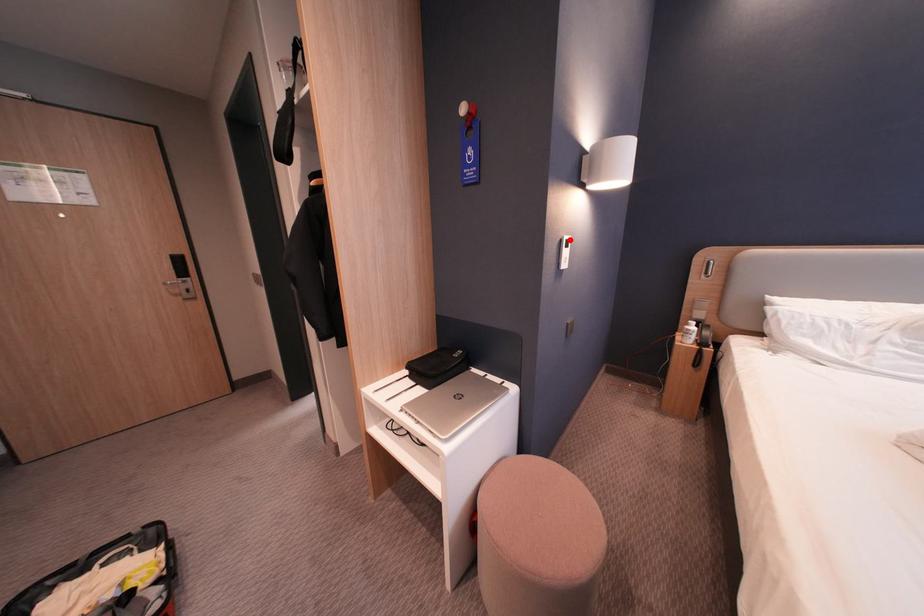
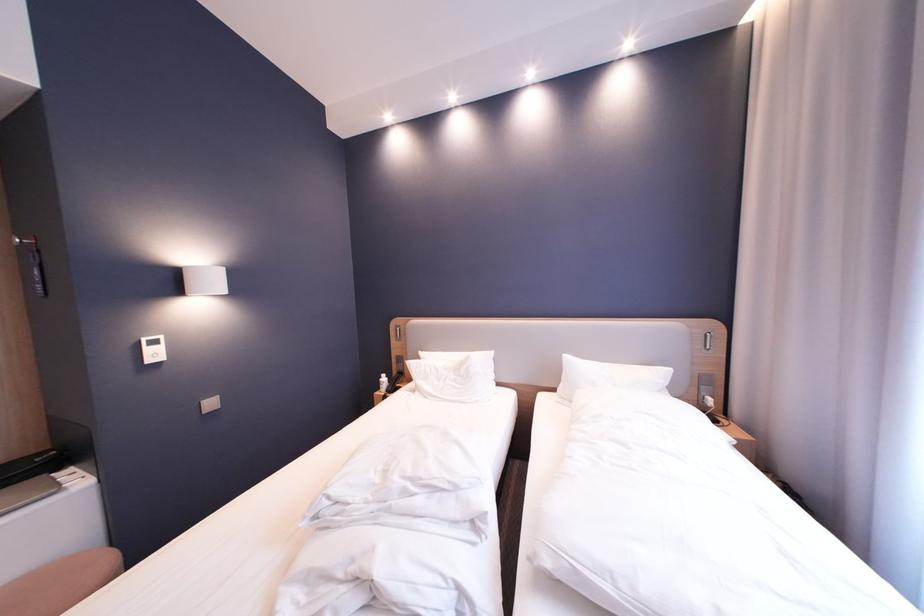
The point at the highlighted location is marked in the first image. Where is the corresponding point in the second image?

(148, 341)